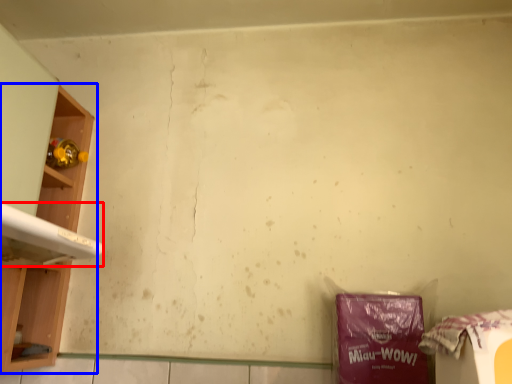
Question: Which point is closer to the camera, washing (highlighted by a red box) or shelf (highlighted by a blue box)?

Choices:
 (A) washing
 (B) shelf

Answer: (A)